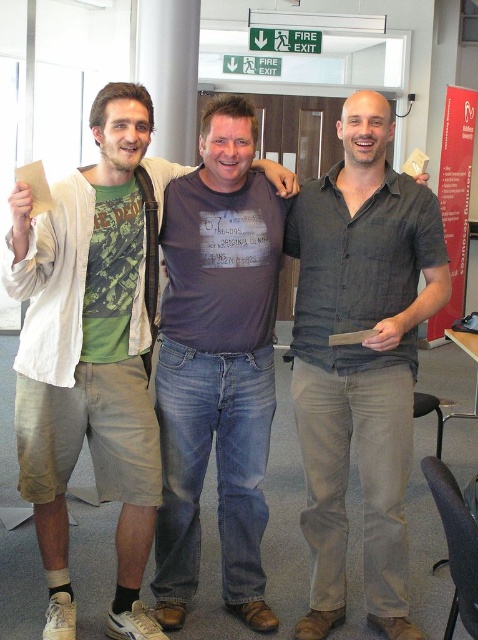
Question: Is green camouflage t-shirt at left to the left of red cardboard sign at right from the viewer's perspective?

Choices:
 (A) yes
 (B) no

Answer: (A)

Question: Which object is positioned closest to the green camouflage t-shirt at left?

Choices:
 (A) gray linen shirt at center
 (B) red cardboard sign at right
 (C) dark gray cotton t-shirt at center

Answer: (C)

Question: Is green camouflage t-shirt at left positioned in front of dark gray cotton t-shirt at center?

Choices:
 (A) yes
 (B) no

Answer: (A)

Question: Based on their relative distances, which object is nearer to the gray linen shirt at center?

Choices:
 (A) green camouflage t-shirt at left
 (B) dark gray cotton t-shirt at center
 (C) red cardboard sign at right

Answer: (B)

Question: Among these objects, which one is farthest from the camera?

Choices:
 (A) green camouflage t-shirt at left
 (B) red cardboard sign at right

Answer: (B)

Question: Is green camouflage t-shirt at left smaller than gray linen shirt at center?

Choices:
 (A) yes
 (B) no

Answer: (B)